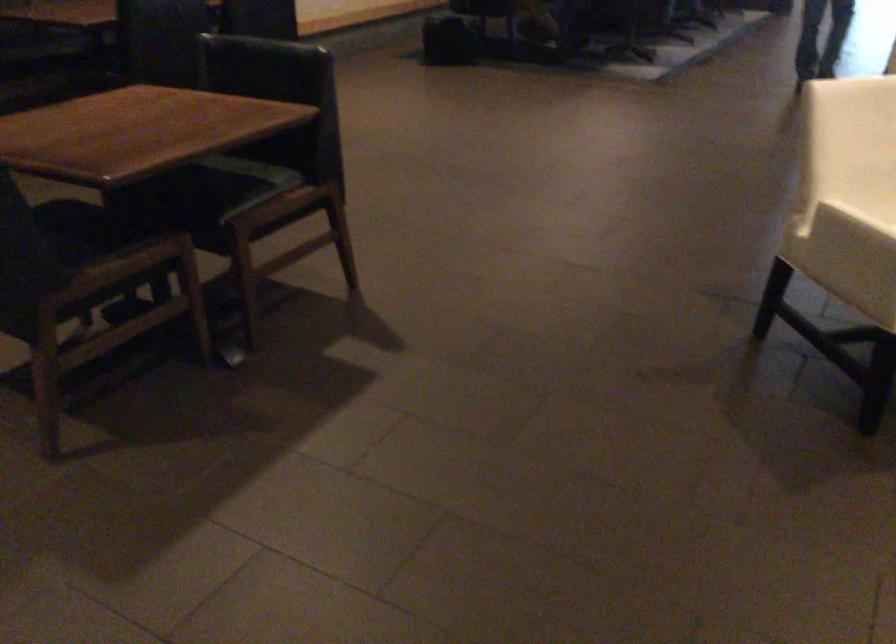
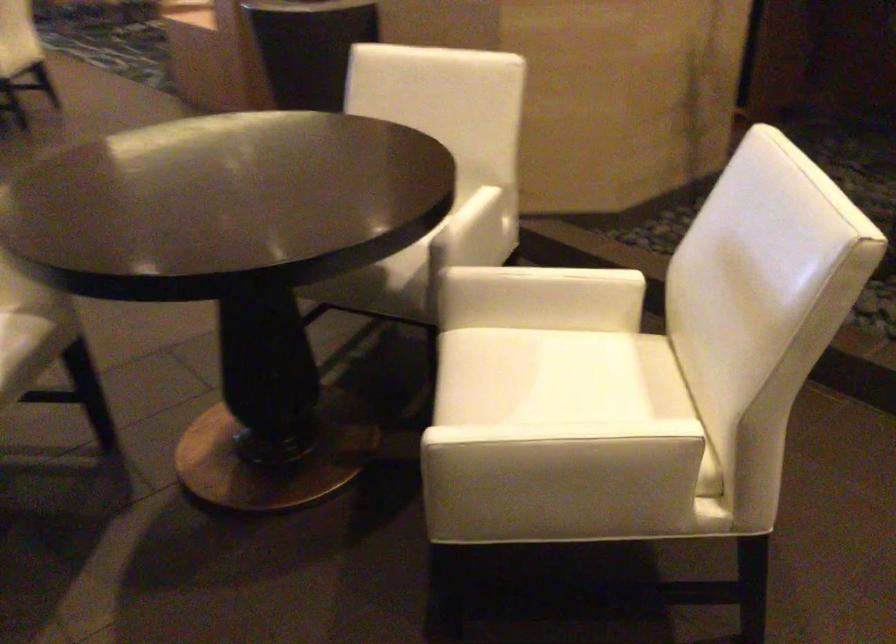
How did the camera likely rotate?

The rotation direction of the camera is right-down.